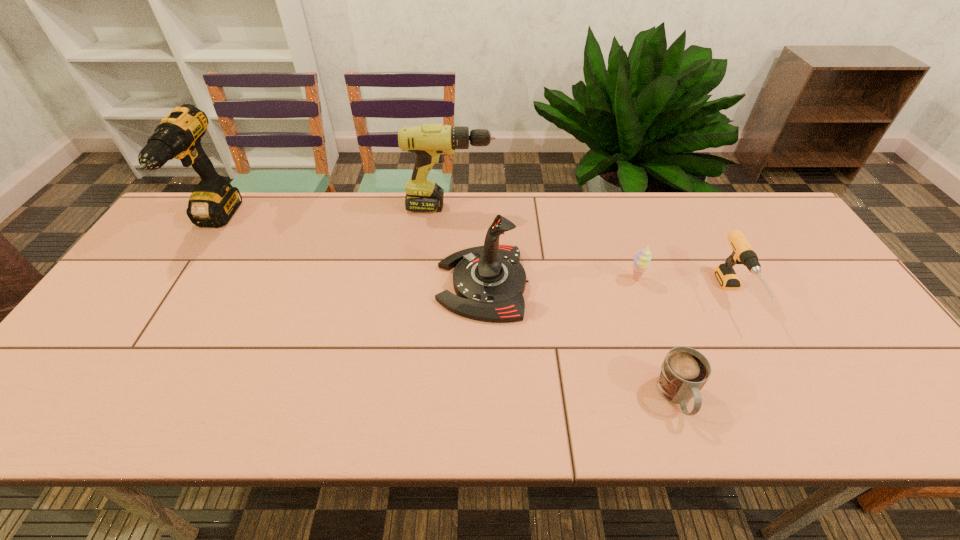
Identify the location of vacant space located 0.290m on the handle side of the fourth shortest object. The width and height of the screenshot is (960, 540). [x=329, y=284].

Where is `vacant space located on the handle side of the fourth shortest object`? vacant space located on the handle side of the fourth shortest object is located at coordinates (396, 284).

Identify the location of free spot located 0.390m on the handle side of the fourth shortest object. The width and height of the screenshot is (960, 540). (293, 284).

Locate an element on the screen. The width and height of the screenshot is (960, 540). free spot located on the handle side of the rightmost object is located at coordinates (780, 383).

Locate an element on the screen. This screenshot has width=960, height=540. vacant space located 0.140m on the back of the second shortest object is located at coordinates (622, 239).

The image size is (960, 540). In order to click on object located in the near edge section of the desktop in this screenshot , I will do `click(684, 371)`.

This screenshot has height=540, width=960. Find the location of `object located at the left edge`. object located at the left edge is located at coordinates (213, 202).

This screenshot has height=540, width=960. What are the coordinates of `object at the far left corner` in the screenshot? It's located at (213, 202).

In the image, there is a desktop. Find the location of `vacant space at the far edge`. vacant space at the far edge is located at coordinates (372, 214).

The image size is (960, 540). In the image, there is a desktop. What are the coordinates of `free space at the near edge` in the screenshot? It's located at (505, 408).